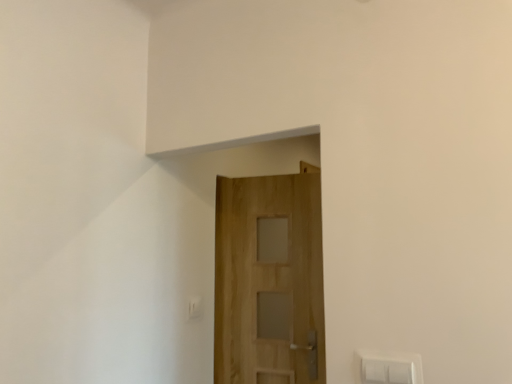
Question: Is natural wood door at center taller or shorter than white plastic light switch at lower center?

Choices:
 (A) short
 (B) tall

Answer: (B)

Question: Is natural wood door at center inside the boundaries of white plastic light switch at lower center, or outside?

Choices:
 (A) outside
 (B) inside

Answer: (A)

Question: Looking at their shapes, would you say natural wood door at center is wider or thinner than white plastic light switch at lower center?

Choices:
 (A) thin
 (B) wide

Answer: (B)

Question: From a real-world perspective, is white plastic light switch at lower center above or below natural wood door at center?

Choices:
 (A) above
 (B) below

Answer: (B)

Question: Looking at their shapes, would you say white plastic light switch at lower center is wider or thinner than natural wood door at center?

Choices:
 (A) wide
 (B) thin

Answer: (B)

Question: Relative to natural wood door at center, is white plastic light switch at lower center in front or behind?

Choices:
 (A) behind
 (B) front

Answer: (A)

Question: From the image's perspective, is white plastic light switch at lower center located above or below natural wood door at center?

Choices:
 (A) above
 (B) below

Answer: (B)